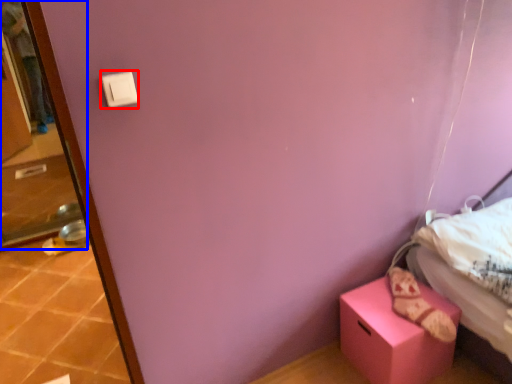
Question: Which object is further to the camera taking this photo, light switch (highlighted by a red box) or screen door (highlighted by a blue box)?

Choices:
 (A) light switch
 (B) screen door

Answer: (B)